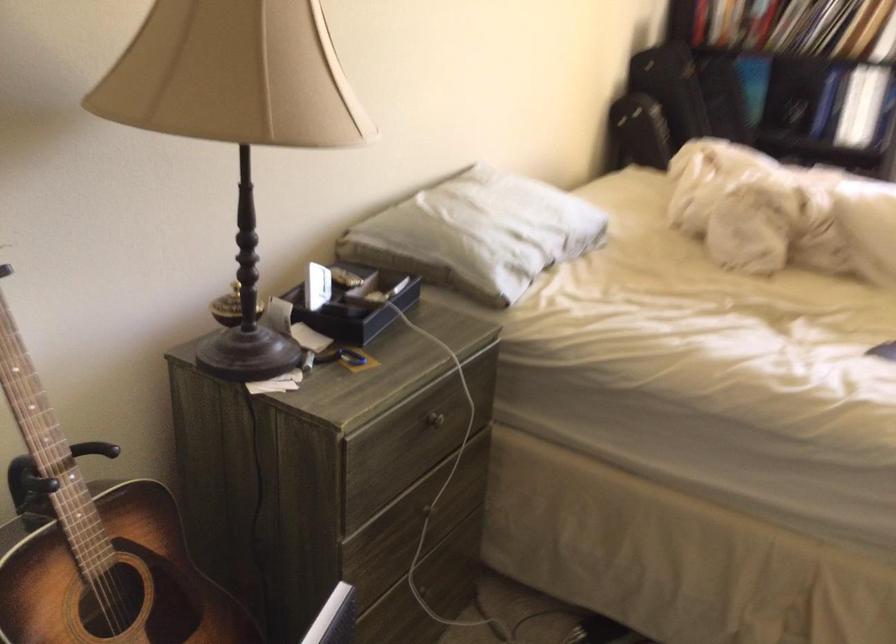
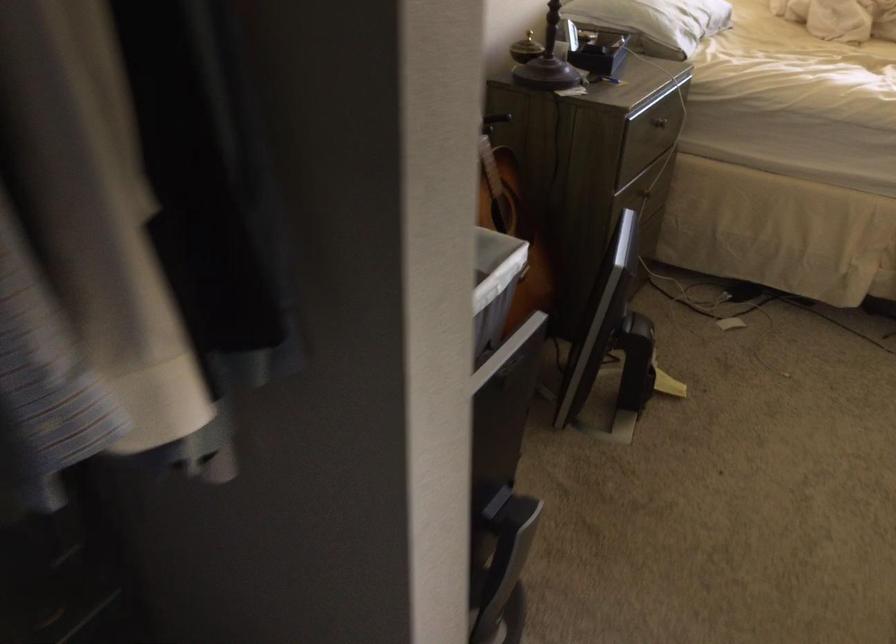
Locate, in the second image, the point that corresponds to (x=428, y=415) in the first image.

(659, 122)